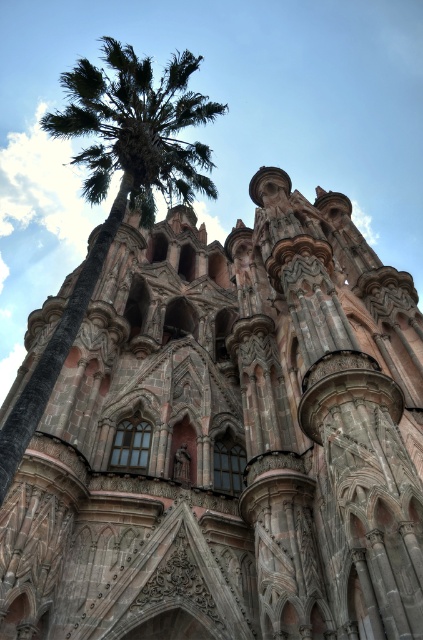
Question: Among these objects, which one is nearest to the camera?

Choices:
 (A) carved stone church at center
 (B) green leafy palm tree at left

Answer: (B)

Question: Is carved stone church at center to the left of green leafy palm tree at left from the viewer's perspective?

Choices:
 (A) no
 (B) yes

Answer: (A)

Question: Is carved stone church at center to the left of green leafy palm tree at left from the viewer's perspective?

Choices:
 (A) yes
 (B) no

Answer: (B)

Question: Which object appears closest to the camera in this image?

Choices:
 (A) carved stone church at center
 (B) green leafy palm tree at left

Answer: (B)

Question: Which object is farther from the camera taking this photo?

Choices:
 (A) carved stone church at center
 (B) green leafy palm tree at left

Answer: (A)

Question: Is carved stone church at center further to the viewer compared to green leafy palm tree at left?

Choices:
 (A) no
 (B) yes

Answer: (B)